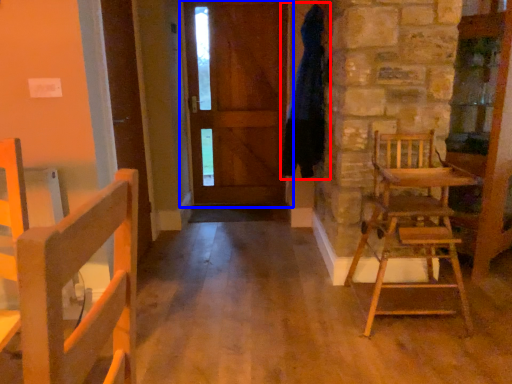
Question: Which point is further to the camera, bathrobe (highlighted by a red box) or door (highlighted by a blue box)?

Choices:
 (A) bathrobe
 (B) door

Answer: (B)